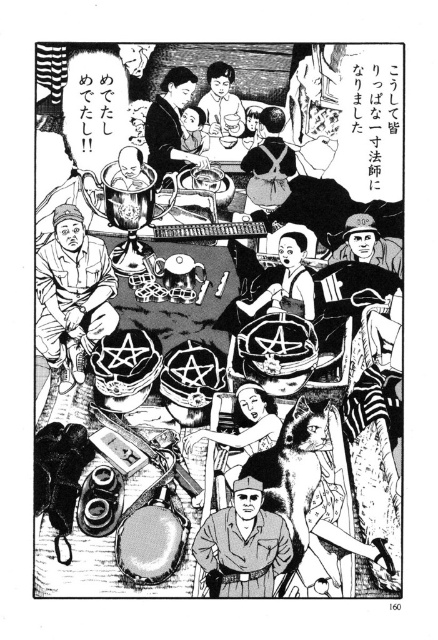
Question: Among these points, which one is farthest from the camera?

Choices:
 (A) (67, 204)
 (B) (158, 538)
 (C) (271, 157)

Answer: (A)

Question: Does matte black apron at center lie behind smooth porcelain cup at upper center?

Choices:
 (A) yes
 (B) no

Answer: (B)

Question: Which object is farther from the camera taking this photo?

Choices:
 (A) smooth porcelain cup at upper center
 (B) smooth black hair at center
 (C) matte black backpack at upper center

Answer: (B)

Question: Does matte black backpack at upper center lie in front of matte black apron at center?

Choices:
 (A) yes
 (B) no

Answer: (B)

Question: Is matte black helmet at center to the right of matte olive green uniform at center from the viewer's perspective?

Choices:
 (A) yes
 (B) no

Answer: (B)

Question: Which object is farther from the camera taking this photo?

Choices:
 (A) smooth porcelain cup at upper center
 (B) smooth black hair at center

Answer: (B)